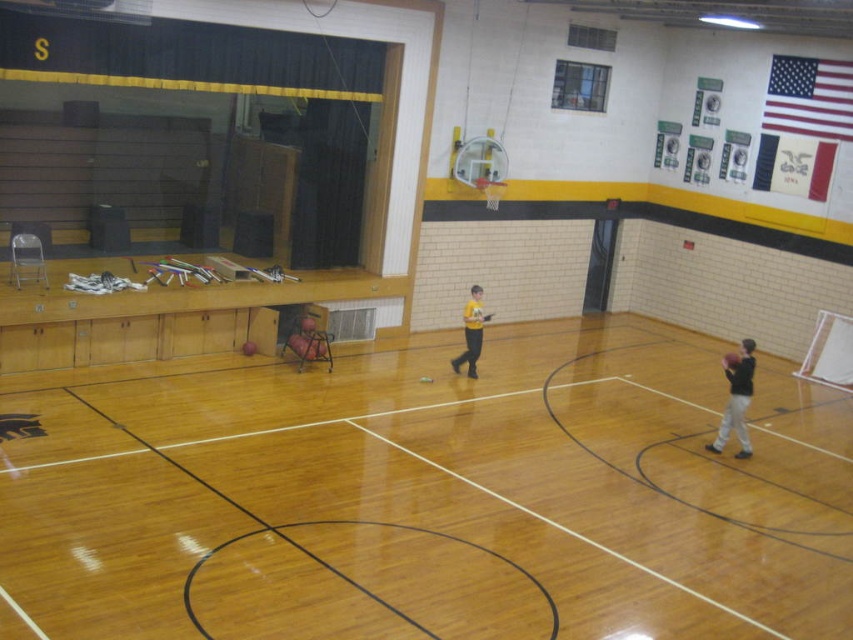
Which is behind, point (732, 390) or point (456, 365)?

Point (456, 365)

Does point (751, 394) come behind point (476, 339)?

No.

Is point (718, 428) farther from camera compared to point (482, 328)?

No, it is not.

You are a GUI agent. You are given a task and a screenshot of the screen. Output one action in this format:
    pyautogui.click(x=<x>, y=<y>)
    Task: Click on the matte black basketball at right
    This screenshot has width=853, height=640.
    Given the screenshot: What is the action you would take?
    pos(735,400)